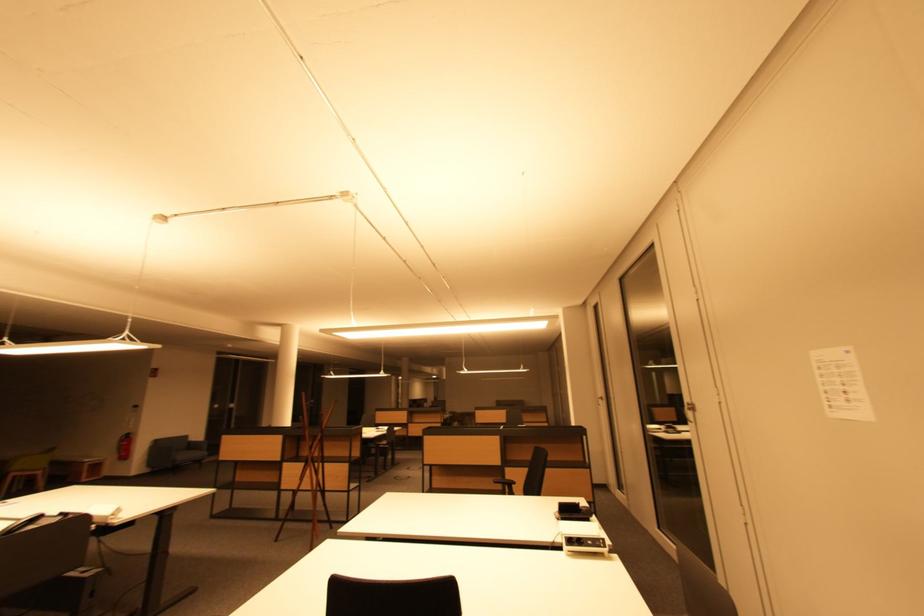
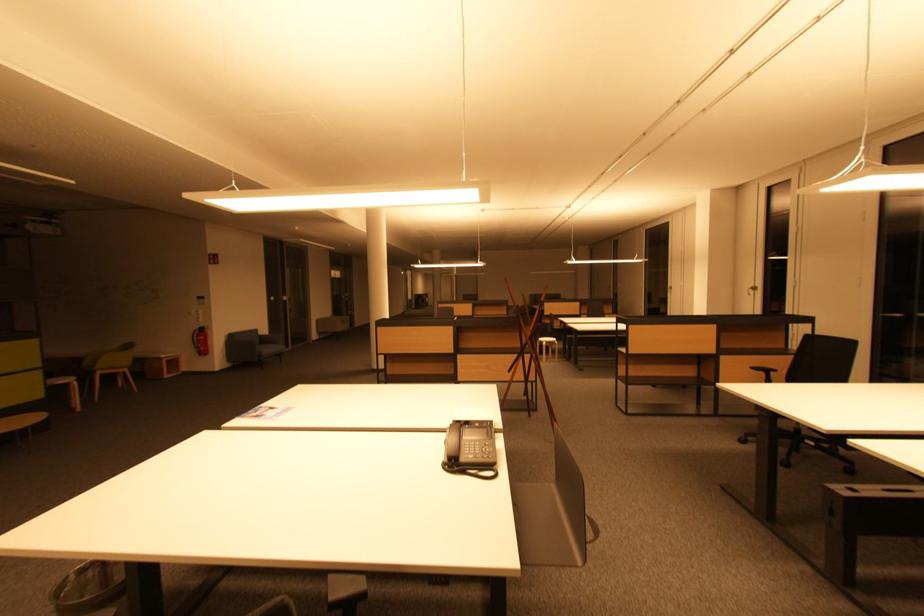
In the second image, find the point that corresponds to (x=128, y=458) in the first image.

(207, 353)